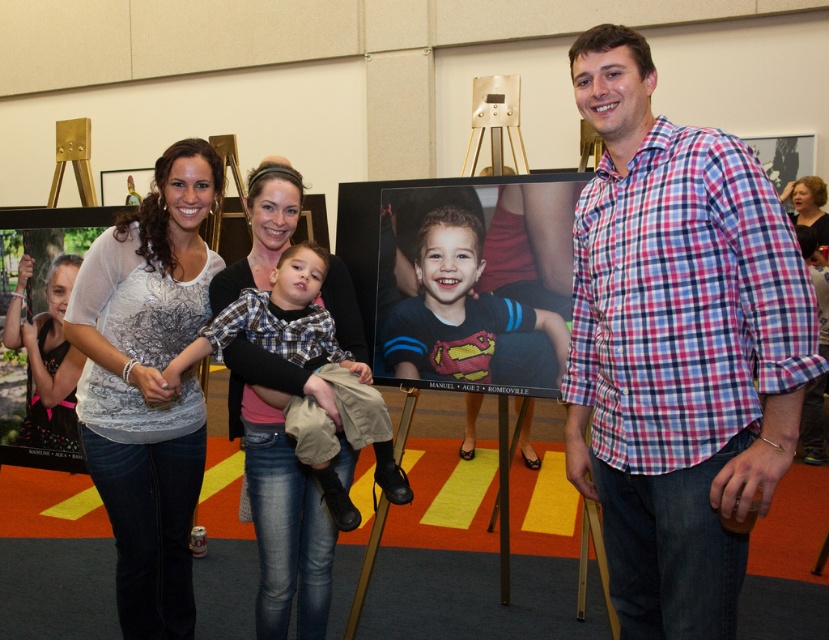
In the scene shown: You are a photographer trying to adjust the lighting for a photo shoot. You notice the matte black shirt at center and the matte plastic photo frame at center. Which object is closer to the left side of the frame?

The matte black shirt at center is positioned on the left side of the matte plastic photo frame at center, so it is closer to the left side of the frame.

You are a photographer setting up for a family photo. You have a matte plastic photo frame at center and a matte black shirt at left in your viewfinder. You need to ensure the distance between them is at least 5 feet for proper composition. Based on the scene description, is the current distance sufficient?

The matte plastic photo frame at center is 4.67 feet from the matte black shirt at left, which is less than the required 5 feet. The distance is insufficient for the desired composition.